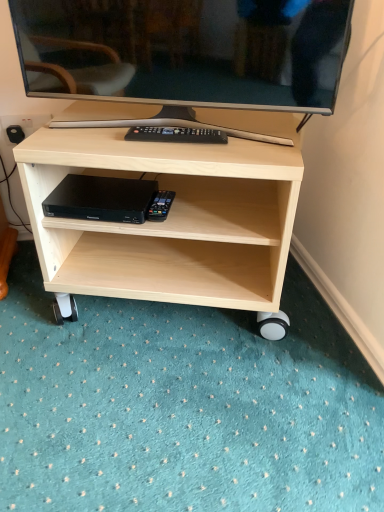
This screenshot has width=384, height=512. In order to click on vacant area that lies in front of light wood shelf at center in this screenshot , I will do `click(180, 406)`.